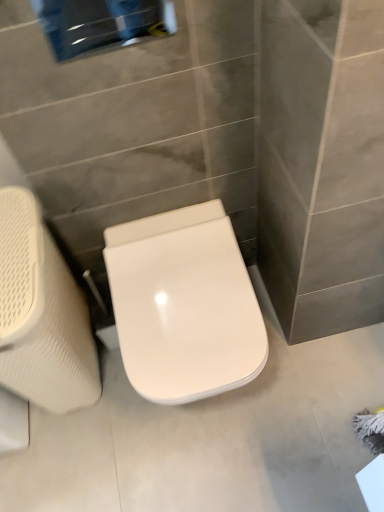
Question: Considering their positions, is white textured swivel chair at left located in front of or behind white glossy toilet seat at center?

Choices:
 (A) front
 (B) behind

Answer: (A)

Question: Considering the positions of white textured swivel chair at left and white glossy toilet seat at center in the image, is white textured swivel chair at left wider or thinner than white glossy toilet seat at center?

Choices:
 (A) thin
 (B) wide

Answer: (A)

Question: Which is correct: white textured swivel chair at left is inside white glossy toilet seat at center, or outside of it?

Choices:
 (A) inside
 (B) outside

Answer: (B)

Question: From the image's perspective, is white glossy toilet seat at center above or below white textured swivel chair at left?

Choices:
 (A) above
 (B) below

Answer: (A)

Question: In terms of width, does white glossy toilet seat at center look wider or thinner when compared to white textured swivel chair at left?

Choices:
 (A) wide
 (B) thin

Answer: (A)

Question: Does point (183, 244) appear closer or farther from the camera than point (91, 360)?

Choices:
 (A) farther
 (B) closer

Answer: (B)

Question: Is white glossy toilet seat at center taller or shorter than white textured swivel chair at left?

Choices:
 (A) short
 (B) tall

Answer: (A)